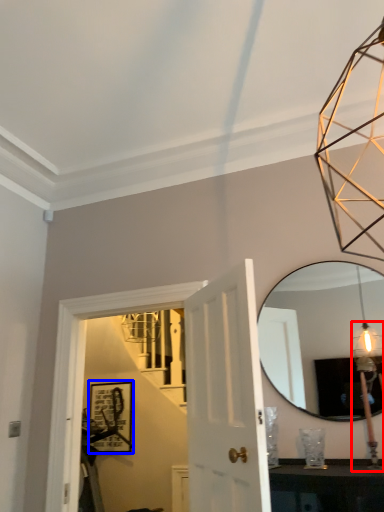
Question: Which object appears farthest to the camera in this image, light fixture (highlighted by a red box) or picture frame (highlighted by a blue box)?

Choices:
 (A) light fixture
 (B) picture frame

Answer: (B)